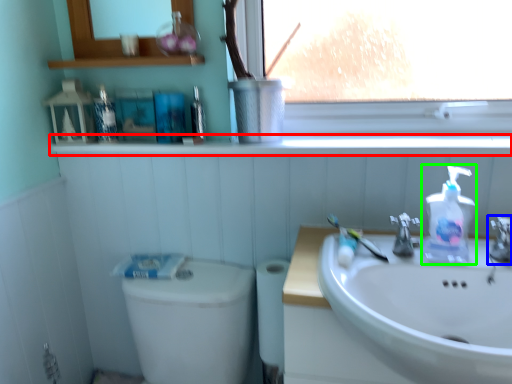
Question: Based on their relative distances, which object is nearer to window sill (highlighted by a red box)? Choose from tap (highlighted by a blue box) and soap dispenser (highlighted by a green box).

Choices:
 (A) tap
 (B) soap dispenser

Answer: (B)